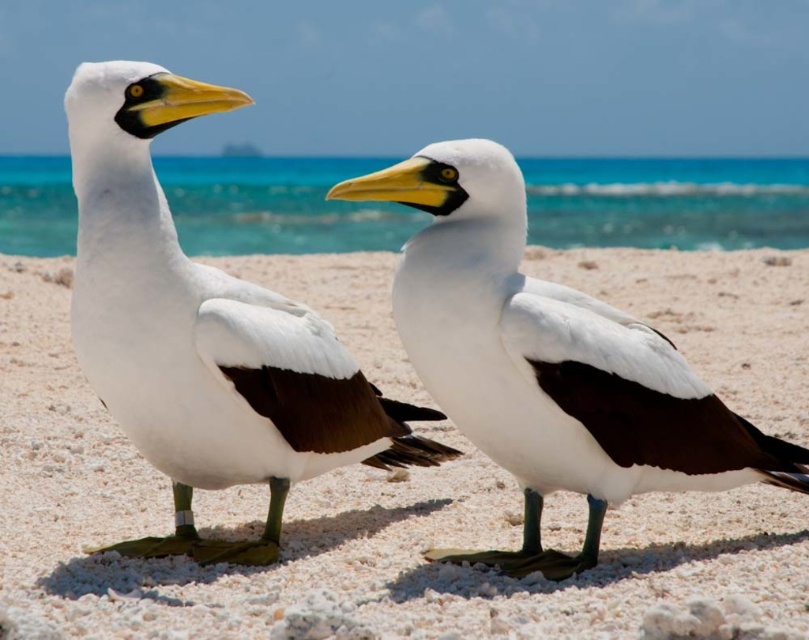
Is white sandy beach at center thinner than white matte mollymawk at left?

No, white sandy beach at center is not thinner than white matte mollymawk at left.

Between white sandy beach at center and white matte mollymawk at left, which one appears on the right side from the viewer's perspective?

Positioned to the right is white matte mollymawk at left.

Is point (20, 401) farther from camera compared to point (316, 474)?

Yes.

You are a GUI agent. You are given a task and a screenshot of the screen. Output one action in this format:
    pyautogui.click(x=<x>, y=<y>)
    Task: Click on the white sandy beach at center
    Image resolution: width=809 pixels, height=640 pixels.
    Given the screenshot: What is the action you would take?
    pyautogui.click(x=337, y=531)

In the scene shown: Does white matte mollymawk at left have a greater height compared to white matte mollymawk at center?

Indeed, white matte mollymawk at left has a greater height compared to white matte mollymawk at center.

Is white matte mollymawk at left thinner than white matte mollymawk at center?

Yes.

Is point (147, 252) less distant than point (593, 481)?

Yes, it is.

You are a GUI agent. You are given a task and a screenshot of the screen. Output one action in this format:
    pyautogui.click(x=<x>, y=<y>)
    Task: Click on the white matte mollymawk at left
    
    Given the screenshot: What is the action you would take?
    pyautogui.click(x=202, y=332)

Is point (15, 445) behind point (411, 182)?

That is True.

At what (x,y) coordinates should I click in order to perform the action: click on white sandy beach at center. Please return your answer as a coordinate pair (x, y). Looking at the image, I should click on (337, 531).